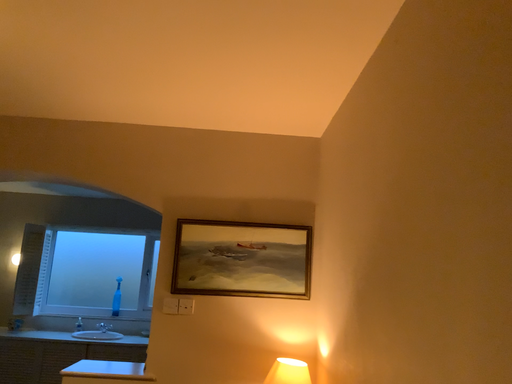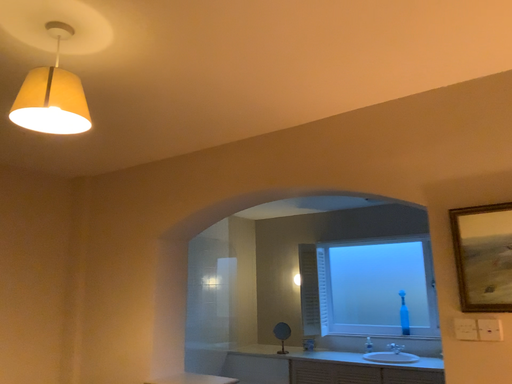
Question: Which way did the camera rotate in the video?

Choices:
 (A) rotated right
 (B) rotated left

Answer: (B)